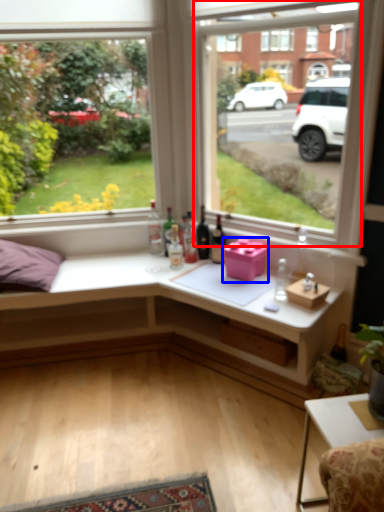
Question: Which point is further to the camera, window (highlighted by a red box) or window box (highlighted by a blue box)?

Choices:
 (A) window
 (B) window box

Answer: (B)